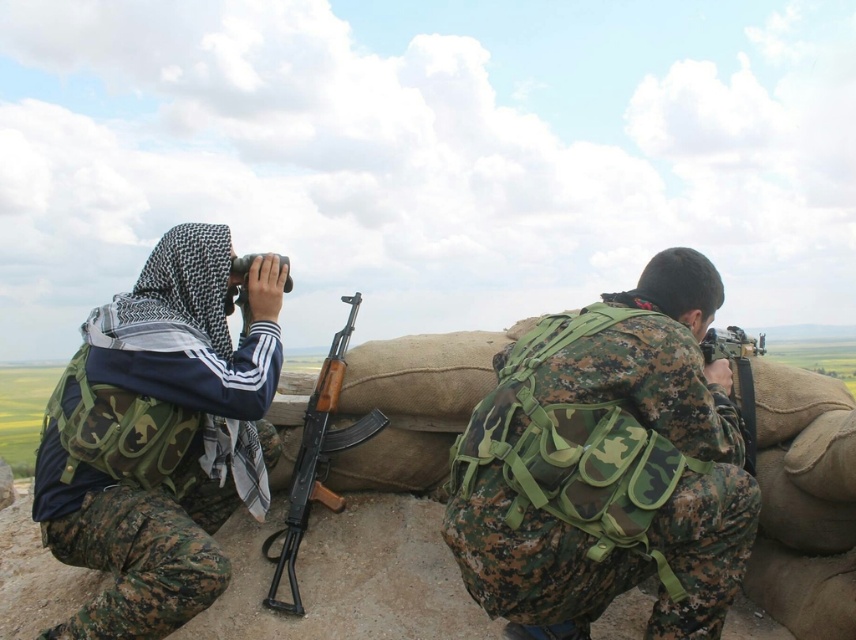
Which is below, camo fabric backpack at center or wooden stock rifle at center?

wooden stock rifle at center

The image size is (856, 640). Identify the location of camo fabric backpack at center. (607, 467).

Does camo fabric backpack at center appear on the right side of matte black binoculars at upper center?

Correct, you'll find camo fabric backpack at center to the right of matte black binoculars at upper center.

Does camo fabric backpack at center have a lesser height compared to matte black binoculars at upper center?

In fact, camo fabric backpack at center may be taller than matte black binoculars at upper center.

Locate an element on the screen. The height and width of the screenshot is (640, 856). camo fabric backpack at center is located at coordinates click(607, 467).

Does point (500, 548) lie behind point (752, 420)?

That is False.

Is camo fabric backpack at center bigger than matte black rifle at center?

Correct, camo fabric backpack at center is larger in size than matte black rifle at center.

Does point (678, 323) come closer to viewer compared to point (753, 400)?

Yes.

This screenshot has width=856, height=640. I want to click on camo fabric backpack at center, so click(x=607, y=467).